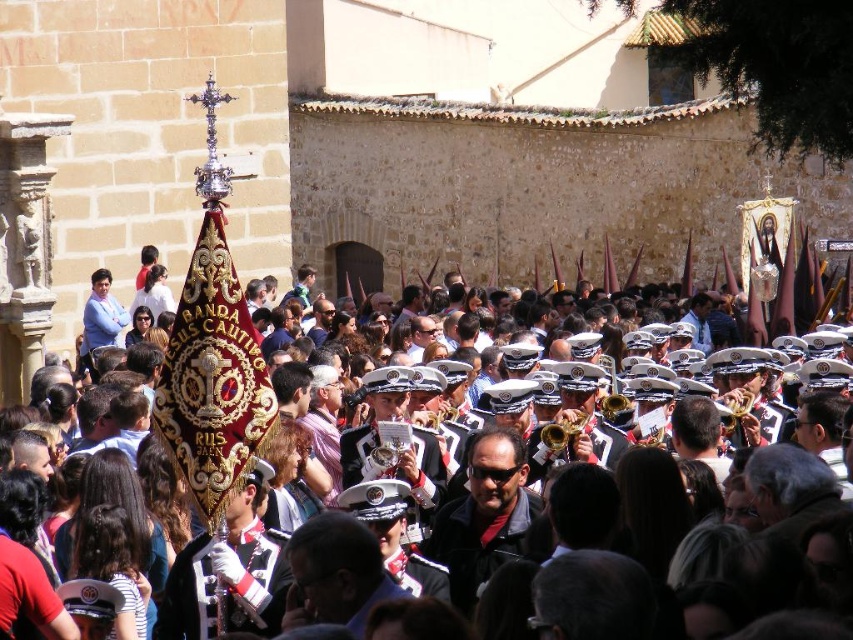
Does velvet red banner at center have a lesser width compared to gold brass trumpet at center?

No.

Describe the element at coordinates (746, 406) in the screenshot. I see `velvet red banner at center` at that location.

Who is more forward, (521, 470) or (576, 420)?

Positioned in front is point (521, 470).

You are a GUI agent. You are given a task and a screenshot of the screen. Output one action in this format:
    pyautogui.click(x=<x>, y=<y>)
    Task: Click on the velvet red banner at center
    The image size is (853, 640).
    Given the screenshot: What is the action you would take?
    pyautogui.click(x=746, y=406)